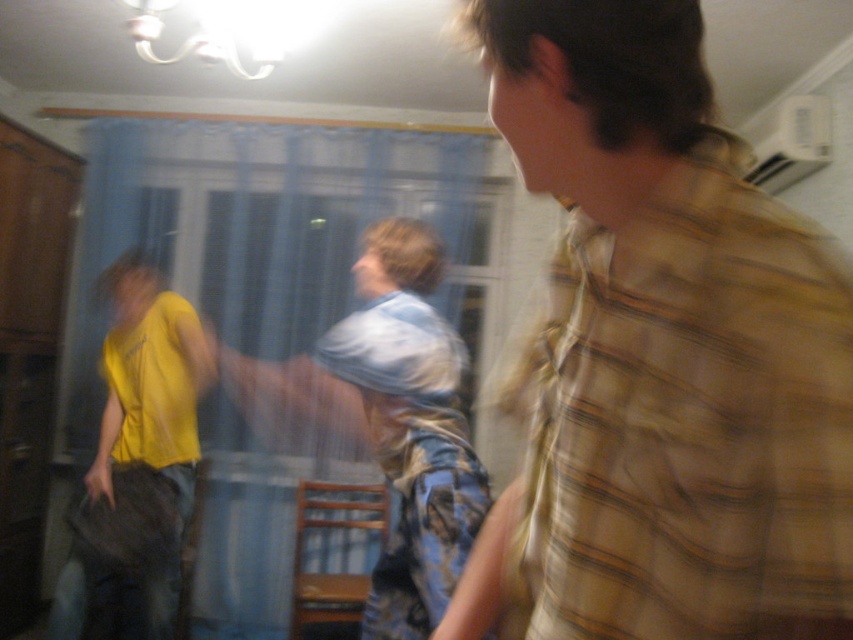
Question: Which point is farther to the camera?

Choices:
 (A) (502, 250)
 (B) (132, 275)
 (C) (792, 582)

Answer: (A)

Question: Is yellow plaid shirt at right smaller than yellow matte shirt at left?

Choices:
 (A) no
 (B) yes

Answer: (B)

Question: Which object is the closest to the blue sheer curtain at center?

Choices:
 (A) yellow matte shirt at left
 (B) yellow plaid shirt at right

Answer: (A)

Question: Which of the following is the closest to the observer?

Choices:
 (A) (125, 378)
 (B) (782, 568)

Answer: (B)

Question: From the image, what is the correct spatial relationship of yellow plaid shirt at right in relation to blue sheer curtain at center?

Choices:
 (A) below
 (B) above

Answer: (B)

Question: Can you confirm if yellow plaid shirt at right is smaller than blue sheer curtain at center?

Choices:
 (A) no
 (B) yes

Answer: (B)